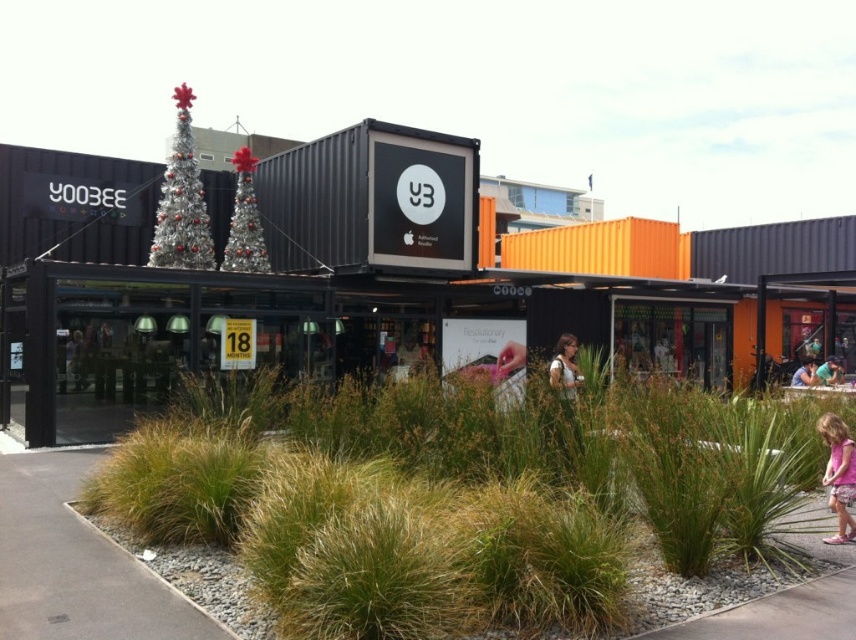
Which is above, green grass at center or gray concrete pavement at lower left?

Positioned higher is green grass at center.

Is green grass at center positioned at the back of gray concrete pavement at lower left?

That is False.

Does point (580, 486) come in front of point (63, 545)?

Yes.

This screenshot has width=856, height=640. In order to click on green grass at center in this screenshot , I will do `click(450, 499)`.

Who is lower down, black matte shipping container at center or pink fabric dress at center?

pink fabric dress at center is lower down.

This screenshot has height=640, width=856. What do you see at coordinates (411, 294) in the screenshot?
I see `black matte shipping container at center` at bounding box center [411, 294].

Is point (381, 134) less distant than point (568, 336)?

Yes.

I want to click on black matte shipping container at center, so click(x=411, y=294).

Is gray concrete pavement at lower left smaller than pink fabric dress at center?

No, gray concrete pavement at lower left is not smaller than pink fabric dress at center.

Is point (56, 465) positioned after point (574, 368)?

Yes, point (56, 465) is farther from viewer.

Locate an element on the screen. gray concrete pavement at lower left is located at coordinates (76, 564).